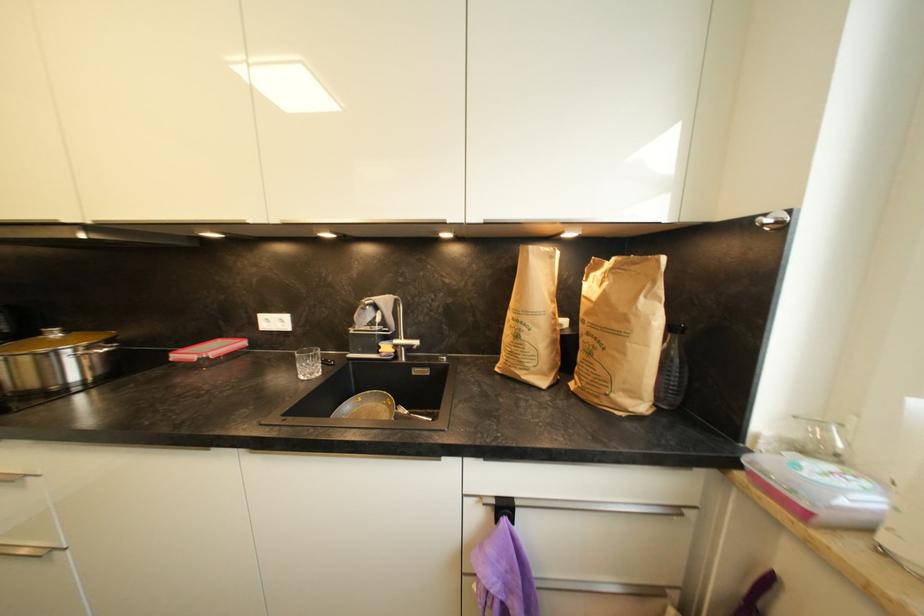
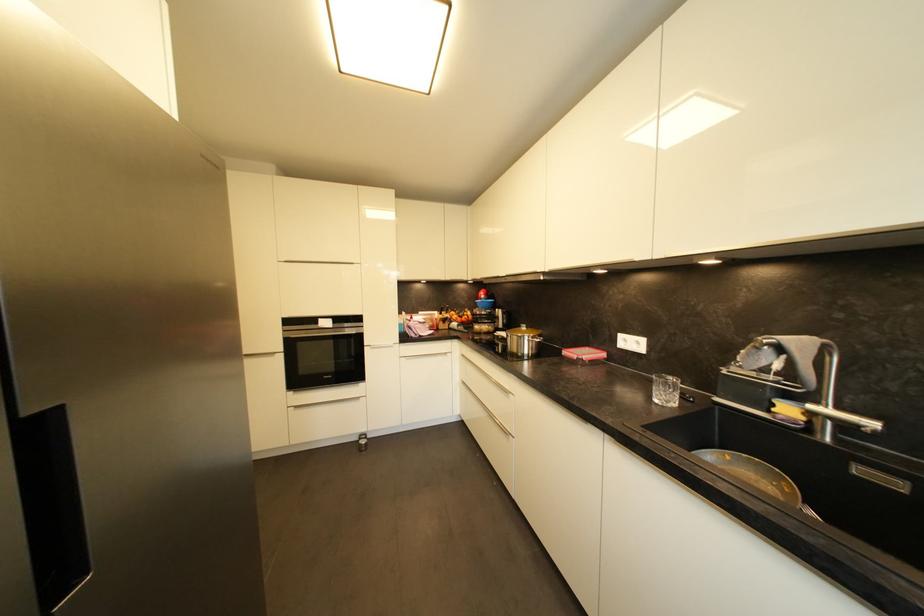
In the second image, find the point that corresponds to (x=286, y=323) in the first image.

(642, 345)